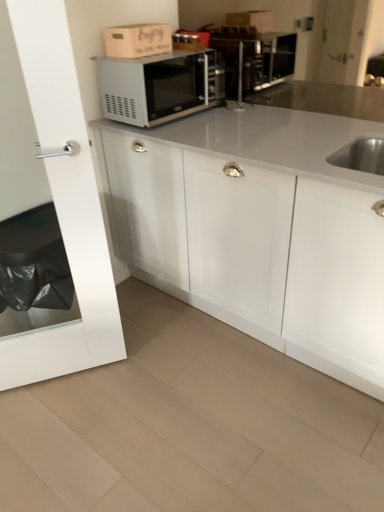
Question: Is satin silver microwave at upper center bigger than white matte cabinet at center?

Choices:
 (A) yes
 (B) no

Answer: (B)

Question: Is satin silver microwave at upper center taller than white matte cabinet at center?

Choices:
 (A) no
 (B) yes

Answer: (A)

Question: From the image's perspective, is satin silver microwave at upper center on top of white matte cabinet at center?

Choices:
 (A) yes
 (B) no

Answer: (A)

Question: Does satin silver microwave at upper center appear on the left side of white matte cabinet at center?

Choices:
 (A) yes
 (B) no

Answer: (A)

Question: Does satin silver microwave at upper center have a lesser height compared to white matte cabinet at center?

Choices:
 (A) no
 (B) yes

Answer: (B)

Question: From the image's perspective, is white matte cabinet at center located above or below satin silver microwave at upper center?

Choices:
 (A) above
 (B) below

Answer: (B)

Question: Is point (119, 204) positioned closer to the camera than point (137, 97)?

Choices:
 (A) farther
 (B) closer

Answer: (A)

Question: Considering their positions, is white matte cabinet at center located in front of or behind satin silver microwave at upper center?

Choices:
 (A) front
 (B) behind

Answer: (A)

Question: From a real-world perspective, is white matte cabinet at center above or below satin silver microwave at upper center?

Choices:
 (A) below
 (B) above

Answer: (A)

Question: From the image's perspective, is transparent glass door at left above or below white matte cabinet at center?

Choices:
 (A) above
 (B) below

Answer: (B)

Question: Is point (112, 332) closer or farther from the camera than point (203, 138)?

Choices:
 (A) farther
 (B) closer

Answer: (A)

Question: Visually, is transparent glass door at left positioned to the left or to the right of white matte cabinet at center?

Choices:
 (A) left
 (B) right

Answer: (A)

Question: Is transparent glass door at left in front of or behind white matte cabinet at center in the image?

Choices:
 (A) front
 (B) behind

Answer: (A)

Question: In terms of width, does wooden cardboard box at upper center look wider or thinner when compared to satin nickel faucet at center?

Choices:
 (A) thin
 (B) wide

Answer: (B)

Question: From a real-world perspective, relative to satin nickel faucet at center, is wooden cardboard box at upper center vertically above or below?

Choices:
 (A) above
 (B) below

Answer: (A)